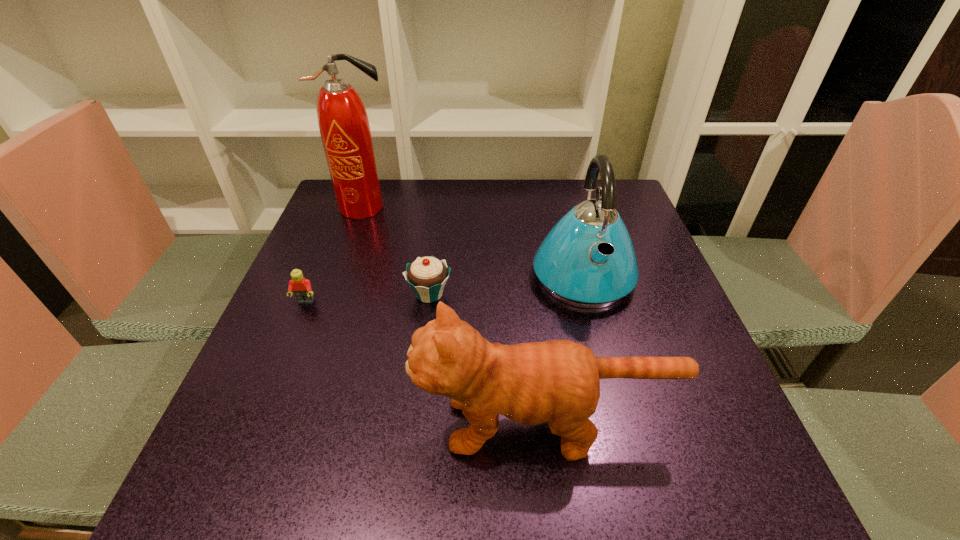
In order to click on free space between the kettle and the fire extinguisher in this screenshot , I will do `click(473, 241)`.

In order to click on free point between the kettle and the second shortest object in this screenshot , I will do `click(506, 285)`.

In order to click on vacant point located between the farthest object and the second shortest object in this screenshot , I will do pyautogui.click(x=396, y=251).

Identify the location of free space between the shortest object and the farthest object. tap(335, 255).

Point out which object is positioned as the second nearest to the Lego. Please provide its 2D coordinates. Your answer should be formatted as a tuple, i.e. [(x, y)], where the tuple contains the x and y coordinates of a point satisfying the conditions above.

[(343, 122)]

This screenshot has width=960, height=540. What are the coordinates of `object that is the third closest to the Lego` in the screenshot? It's located at (557, 381).